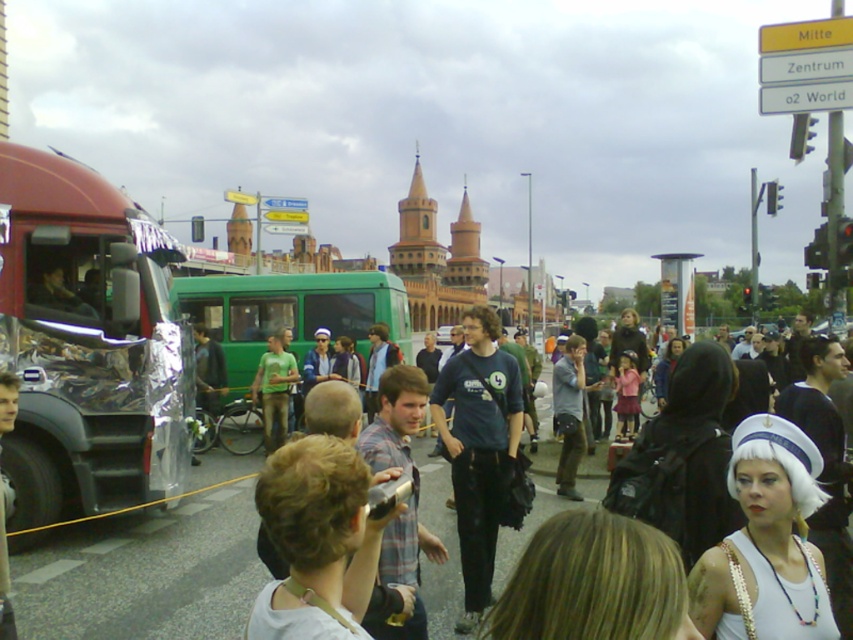
Question: Which point is farther to the camera?

Choices:
 (A) (360, 600)
 (B) (451, 538)
 (C) (798, 509)
 (D) (67, 310)

Answer: (B)

Question: Is matte black backpack at center above matte black camera at lower left?

Choices:
 (A) no
 (B) yes

Answer: (B)

Question: Considering the relative positions of white matte wig at center and matte black camera at lower left in the image provided, where is white matte wig at center located with respect to matte black camera at lower left?

Choices:
 (A) left
 (B) right

Answer: (B)

Question: Among these points, which one is nearest to the camera?

Choices:
 (A) (3, 595)
 (B) (138, 490)
 (C) (740, 488)
 (D) (306, 528)

Answer: (D)

Question: Considering the relative positions of matte black backpack at center and matte black camera at lower left in the image provided, where is matte black backpack at center located with respect to matte black camera at lower left?

Choices:
 (A) left
 (B) right

Answer: (B)

Question: Among these points, which one is nearest to the camera?

Choices:
 (A) (427, 502)
 (B) (113, 417)
 (C) (4, 392)
 (D) (802, 580)

Answer: (D)